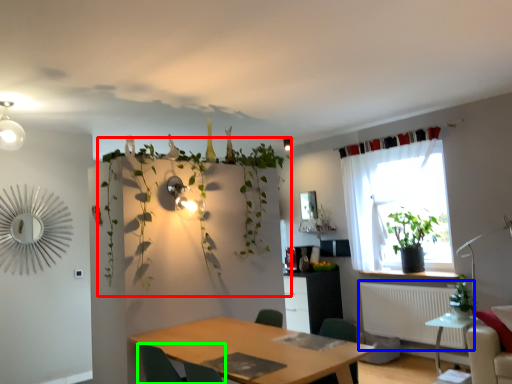
Question: Which object is the closest to the vegetation (highlighted by a red box)? Choose among these: radiator (highlighted by a blue box) or chair (highlighted by a green box).

Choices:
 (A) radiator
 (B) chair

Answer: (B)